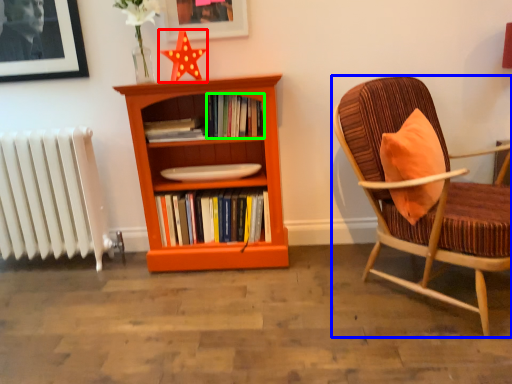
Question: Which is nearer to the star (highlighted by a red box)? chair (highlighted by a blue box) or book (highlighted by a green box).

Choices:
 (A) chair
 (B) book

Answer: (B)